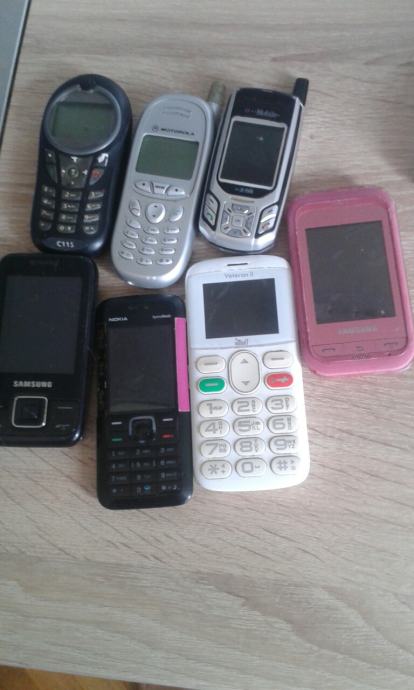
Locate an element on the screen. The image size is (414, 690). screens is located at coordinates (41, 326), (233, 313), (341, 288), (258, 157), (181, 168), (81, 130).